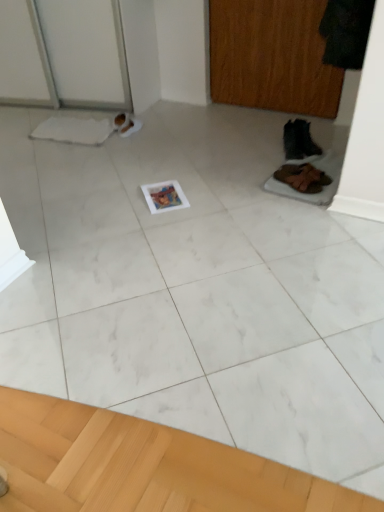
Question: Is wooden screen door at upper right in contact with black leather boot at right, the first footwear in the back-to-front sequence?

Choices:
 (A) no
 (B) yes

Answer: (A)

Question: Is wooden screen door at upper right wider than black leather boot at right, marked as the 2th footwear in a front-to-back arrangement?

Choices:
 (A) no
 (B) yes

Answer: (A)

Question: Is wooden screen door at upper right positioned far away from black leather boot at right, marked as the 2th footwear in a front-to-back arrangement?

Choices:
 (A) yes
 (B) no

Answer: (B)

Question: Is wooden screen door at upper right further to the viewer compared to black leather boot at right, marked as the 2th footwear in a front-to-back arrangement?

Choices:
 (A) yes
 (B) no

Answer: (A)

Question: Is wooden screen door at upper right aimed at black leather boot at right, the first footwear in the back-to-front sequence?

Choices:
 (A) no
 (B) yes

Answer: (B)

Question: From the image's perspective, is black leather boot at right, marked as the 2th footwear in a front-to-back arrangement, above or below wooden screen door at upper right?

Choices:
 (A) above
 (B) below

Answer: (B)

Question: Is black leather boot at right, the 1th footwear viewed from the top, situated inside wooden screen door at upper right or outside?

Choices:
 (A) outside
 (B) inside

Answer: (A)

Question: In terms of width, does black leather boot at right, the second footwear when ordered from bottom to top, look wider or thinner when compared to wooden screen door at upper right?

Choices:
 (A) wide
 (B) thin

Answer: (A)

Question: Is point (306, 140) closer or farther from the camera than point (296, 5)?

Choices:
 (A) farther
 (B) closer

Answer: (B)

Question: In the image, is wooden screen door at upper right positioned in front of or behind brown suede shoes at lower right, the second footwear viewed from the back?

Choices:
 (A) front
 (B) behind

Answer: (B)

Question: Does point (233, 19) appear closer or farther from the camera than point (304, 192)?

Choices:
 (A) farther
 (B) closer

Answer: (A)

Question: Considering the positions of wooden screen door at upper right and brown suede shoes at lower right, the second footwear viewed from the back, in the image, is wooden screen door at upper right taller or shorter than brown suede shoes at lower right, the second footwear viewed from the back,?

Choices:
 (A) tall
 (B) short

Answer: (A)

Question: From a real-world perspective, relative to brown suede shoes at lower right, which appears as the second footwear when viewed from the top, is wooden screen door at upper right vertically above or below?

Choices:
 (A) above
 (B) below

Answer: (A)

Question: Is brown suede shoes at lower right, the second footwear viewed from the back, taller or shorter than black leather boot at right, the first footwear in the back-to-front sequence?

Choices:
 (A) short
 (B) tall

Answer: (A)

Question: Based on their positions, is brown suede shoes at lower right, which appears as the second footwear when viewed from the top, located to the left or right of black leather boot at right, the 1th footwear viewed from the top?

Choices:
 (A) right
 (B) left

Answer: (B)